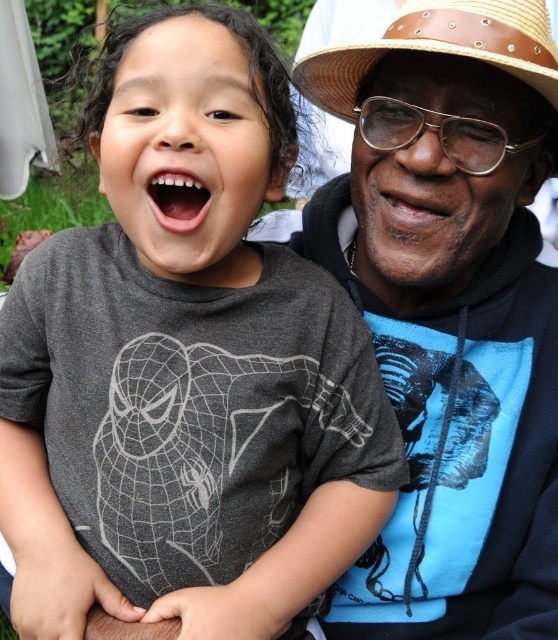
Question: Observing the image, what is the correct spatial positioning of blue cotton hoodie at upper right in reference to gray matte t-shirt at left?

Choices:
 (A) left
 (B) right

Answer: (B)

Question: Estimate the real-world distances between objects in this image. Which object is farther from the braided straw cowboy hat at upper right?

Choices:
 (A) gray matte t-shirt at left
 (B) blue cotton hoodie at upper right

Answer: (A)

Question: Does gray matte t-shirt at left appear over braided straw cowboy hat at upper right?

Choices:
 (A) no
 (B) yes

Answer: (A)

Question: Is the position of blue cotton hoodie at upper right more distant than that of gray matte t-shirt at left?

Choices:
 (A) yes
 (B) no

Answer: (A)

Question: Which object is farther from the camera taking this photo?

Choices:
 (A) blue cotton hoodie at upper right
 (B) gray matte t-shirt at left

Answer: (A)

Question: Which object is the farthest from the gray matte t-shirt at left?

Choices:
 (A) braided straw cowboy hat at upper right
 (B) blue cotton hoodie at upper right

Answer: (A)